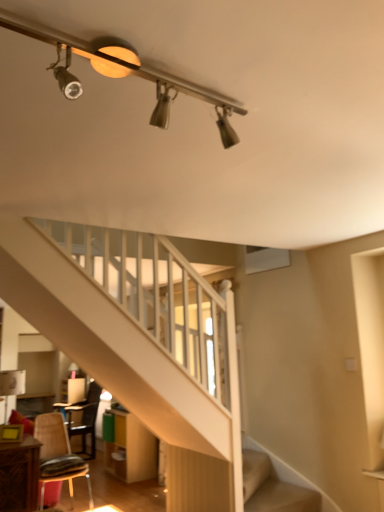
Locate an element on the screen. This screenshot has width=384, height=512. empty space that is ontop of metallic track lighting at upper center (from a real-world perspective) is located at coordinates (135, 59).